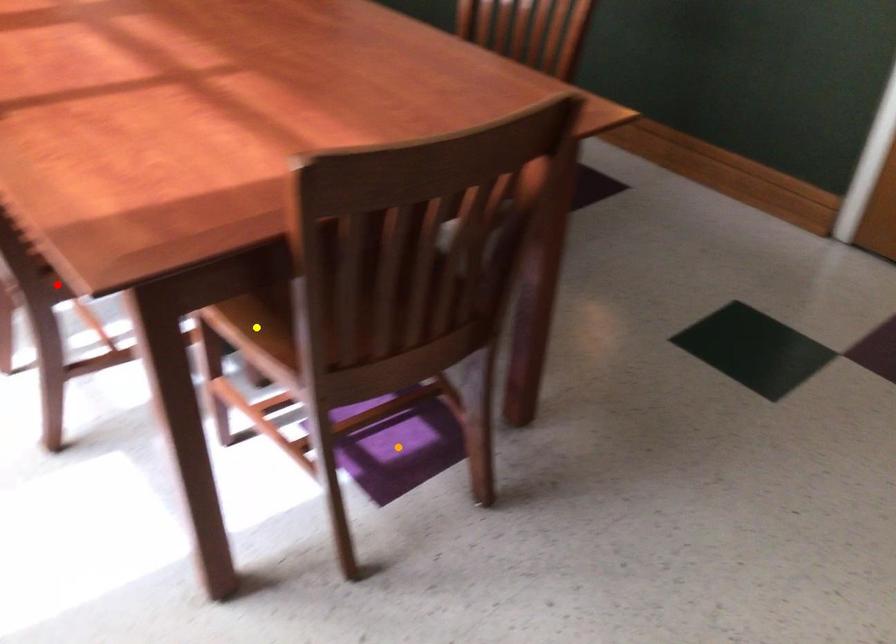
From the picture: Order these from nearest to farthest:
yellow point, orange point, red point

orange point → red point → yellow point